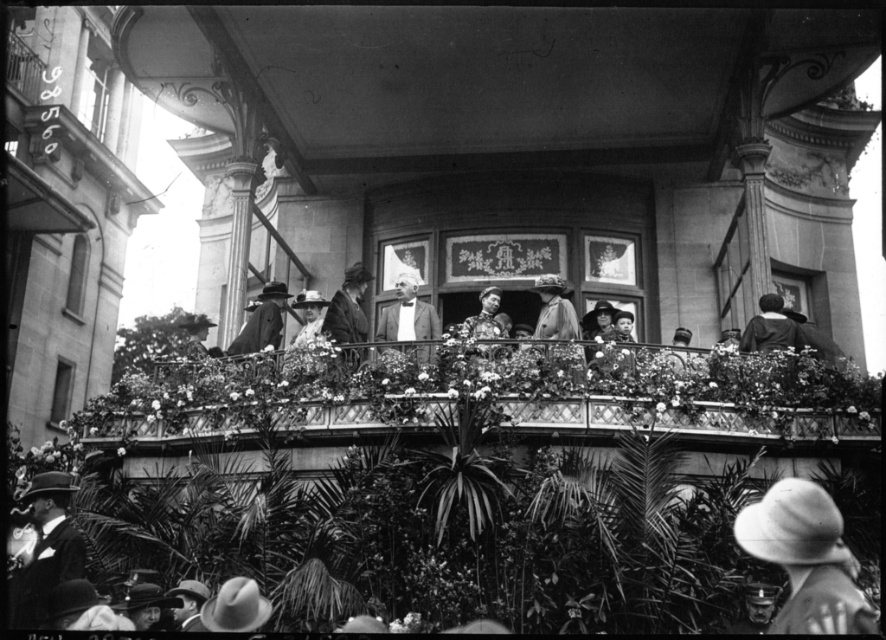
Does wooden railing at center appear on the left side of smooth brown coat at center?

No, wooden railing at center is not to the left of smooth brown coat at center.

Does point (588, 372) come behind point (351, 268)?

No, it is not.

Where is `wooden railing at center`? This screenshot has height=640, width=886. wooden railing at center is located at coordinates [x=494, y=392].

Does point (410, 326) come closer to viewer compared to point (486, 330)?

No, it is behind (486, 330).

Who is positioned more to the left, light gray fabric suit at center or smooth leather jacket at center?

Positioned to the left is light gray fabric suit at center.

Find the location of a particular element. This screenshot has width=886, height=640. light gray fabric suit at center is located at coordinates (408, 321).

Find the location of a particular element. This screenshot has width=886, height=640. light gray fabric suit at center is located at coordinates (408, 321).

Describe the element at coordinates (494, 392) in the screenshot. I see `wooden railing at center` at that location.

Who is more forward, (465, 342) or (61, 536)?

Point (61, 536)

Is point (131, 422) behind point (47, 481)?

That is True.

This screenshot has height=640, width=886. Find the location of `wooden railing at center`. wooden railing at center is located at coordinates (494, 392).